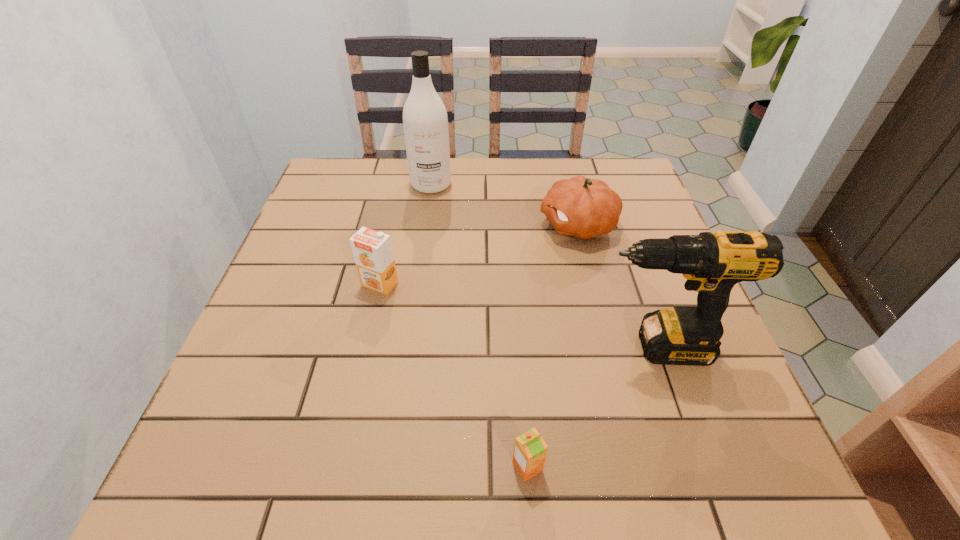
At what (x,y) coordinates should I click in order to perform the action: click on object at the near edge. Please return your answer as a coordinate pair (x, y). The image size is (960, 540). Looking at the image, I should click on (530, 450).

At what (x,y) coordinates should I click in order to perform the action: click on drill located in the right edge section of the desktop. Please return your answer as a coordinate pair (x, y). The height and width of the screenshot is (540, 960). Looking at the image, I should click on (712, 262).

You are a GUI agent. You are given a task and a screenshot of the screen. Output one action in this format:
    pyautogui.click(x=<x>, y=<y>)
    Task: Click on the pumpkin located in the right edge section of the desktop
    
    Given the screenshot: What is the action you would take?
    pyautogui.click(x=581, y=207)

Locate an element on the screen. object present at the far right corner is located at coordinates (581, 207).

In the image, there is a desktop. At what (x,y) coordinates should I click in order to perform the action: click on vacant space at the far edge. Please return your answer as a coordinate pair (x, y). Looking at the image, I should click on coord(407,181).

Locate an element on the screen. The image size is (960, 540). vacant position at the near edge of the desktop is located at coordinates (408, 444).

The height and width of the screenshot is (540, 960). In the image, there is a desktop. What are the coordinates of `free space at the left edge` in the screenshot? It's located at (278, 304).

Find the location of a particular element. free space at the right edge of the desktop is located at coordinates (616, 257).

Image resolution: width=960 pixels, height=540 pixels. What are the coordinates of `vacant space at the near left corner` in the screenshot? It's located at (266, 500).

In the image, there is a desktop. At what (x,y) coordinates should I click in order to perform the action: click on vacant space at the far right corner. Please return your answer as a coordinate pair (x, y). This screenshot has height=540, width=960. Looking at the image, I should click on (612, 184).